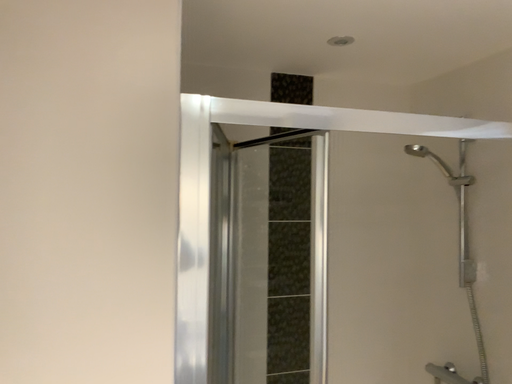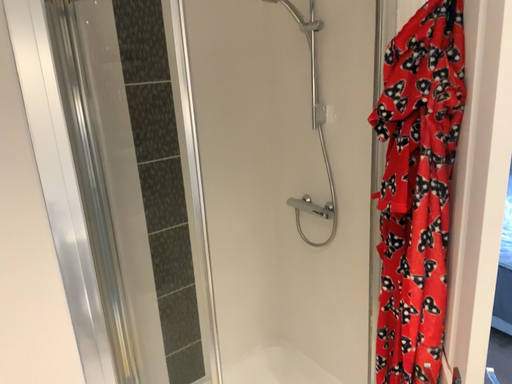
Question: Which way did the camera rotate in the video?

Choices:
 (A) rotated downward
 (B) rotated upward

Answer: (A)